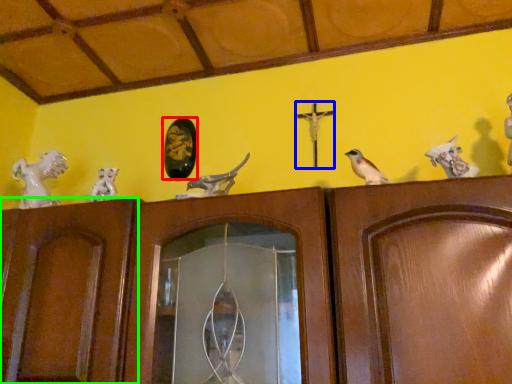
Question: Which object is positioned farthest from art (highlighted by a red box)? Select from crucifix (highlighted by a blue box) and door (highlighted by a green box).

Choices:
 (A) crucifix
 (B) door

Answer: (B)